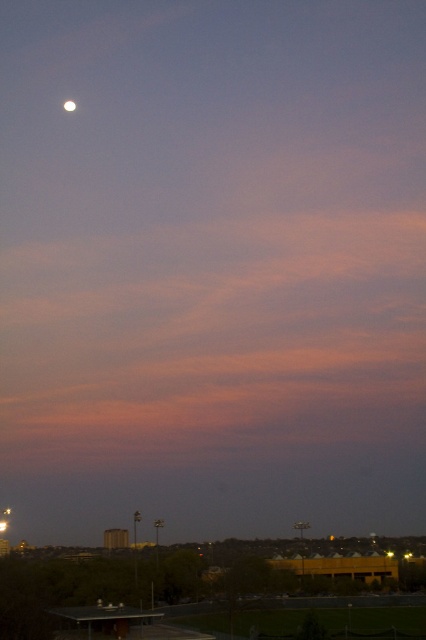
Question: Can you confirm if metallic gray stadium lights at lower center is positioned to the right of silvery reflective moon at upper left?

Choices:
 (A) yes
 (B) no

Answer: (A)

Question: Can you confirm if metallic gray stadium lights at lower center is positioned to the left of silvery reflective moon at upper left?

Choices:
 (A) yes
 (B) no

Answer: (B)

Question: Does metallic gray stadium lights at lower center have a lesser width compared to silvery reflective moon at upper left?

Choices:
 (A) yes
 (B) no

Answer: (B)